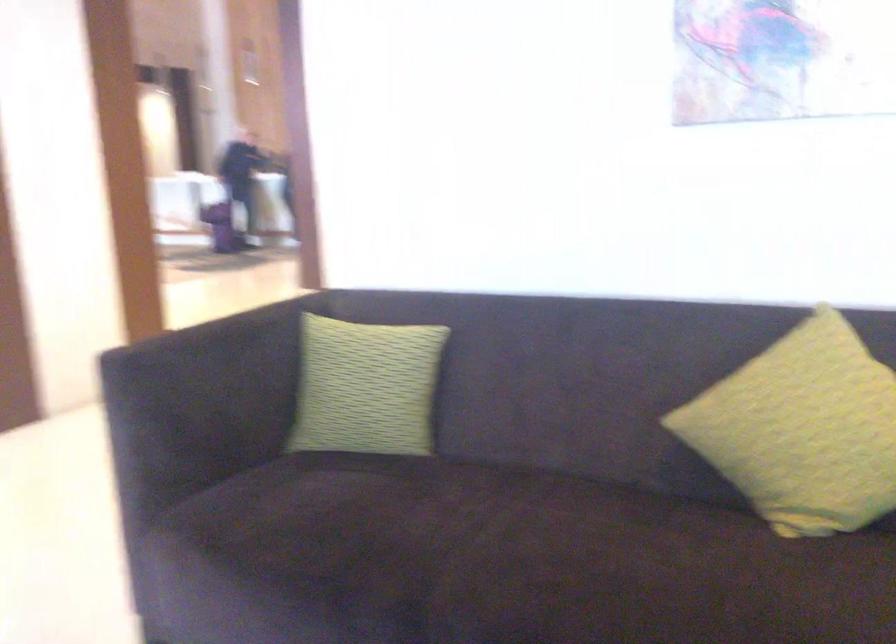
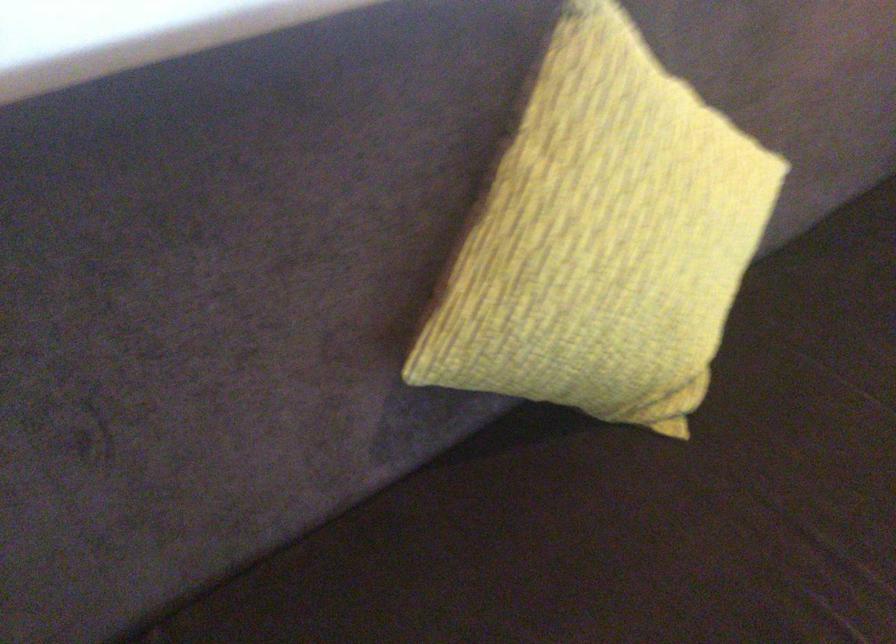
Where in the second image is the point corresponding to pixel 789 402 from the first image?

(602, 237)